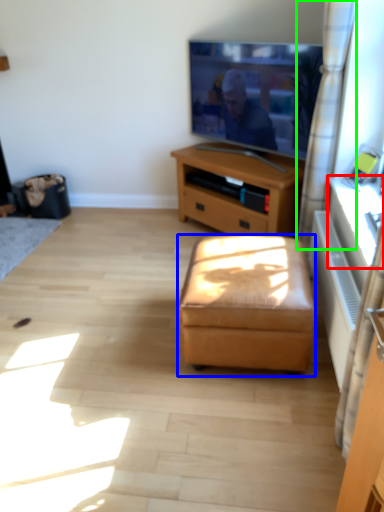
Question: Estimate the real-world distances between objects in this image. Which object is farther from table (highlighted by a red box), stool (highlighted by a blue box) or curtain (highlighted by a green box)?

Choices:
 (A) stool
 (B) curtain

Answer: (A)